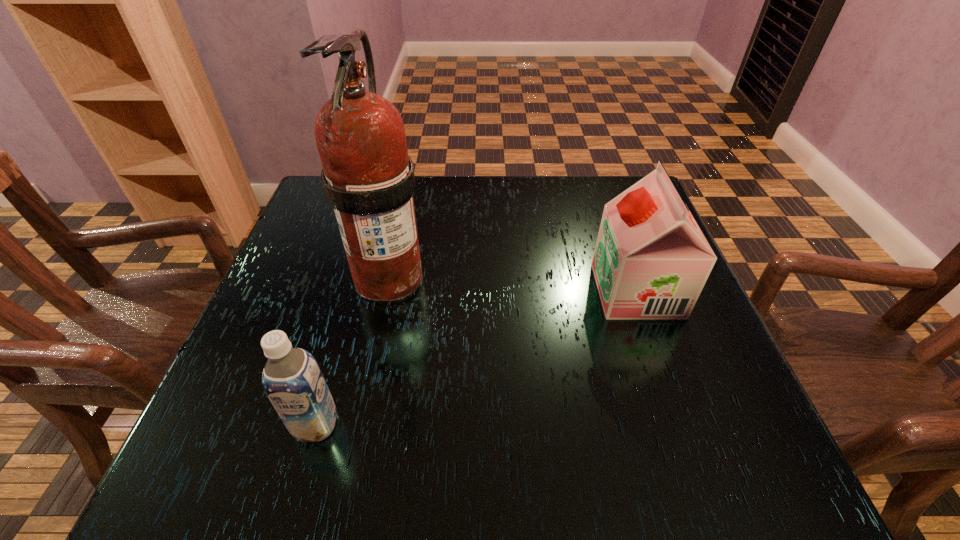
I want to click on object located at the left edge, so click(x=292, y=379).

Locate an element on the screen. Image resolution: width=960 pixels, height=540 pixels. object located in the right edge section of the desktop is located at coordinates pyautogui.click(x=651, y=261).

The width and height of the screenshot is (960, 540). I want to click on object located in the near left corner section of the desktop, so (x=292, y=379).

The height and width of the screenshot is (540, 960). In order to click on vacant space at the far edge of the desktop in this screenshot , I will do `click(564, 198)`.

This screenshot has height=540, width=960. In the image, there is a desktop. Identify the location of vacant space at the left edge. (234, 409).

The height and width of the screenshot is (540, 960). In the image, there is a desktop. Identify the location of vacant space at the far left corner. (318, 224).

You are a GUI agent. You are given a task and a screenshot of the screen. Output one action in this format:
    pyautogui.click(x=<x>, y=<y>)
    Task: Click on the vacant space at the near left corner of the desktop
    Image resolution: width=960 pixels, height=540 pixels.
    Given the screenshot: What is the action you would take?
    pyautogui.click(x=290, y=443)

In order to click on blank space at the far right corner in this screenshot , I will do click(602, 200).

At what (x,y) coordinates should I click in order to perform the action: click on free spot between the shortest object and the second shortest object. Please return your answer as a coordinate pair (x, y). Image resolution: width=960 pixels, height=540 pixels. Looking at the image, I should click on (476, 357).

You are a GUI agent. You are given a task and a screenshot of the screen. Output one action in this format:
    pyautogui.click(x=<x>, y=<y>)
    Task: Click on the empty location between the second tallest object and the shorter soya milk
    This screenshot has height=540, width=960.
    Given the screenshot: What is the action you would take?
    pyautogui.click(x=476, y=357)